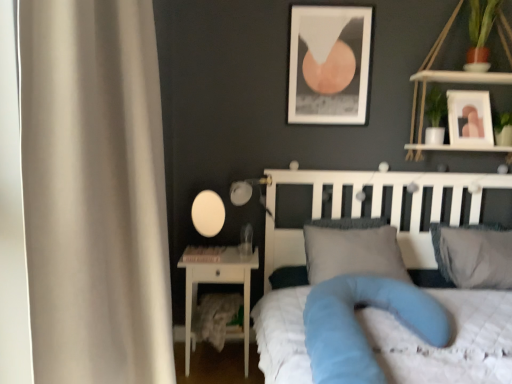
Locate an element on the screen. gray fabric pillow at center, placed as the 1th pillow when sorted from left to right is located at coordinates (353, 253).

Measure the distance between point [310,271] and camera.

The distance of point [310,271] from camera is 7.57 feet.

Describe the element at coordinates (94, 192) in the screenshot. The image size is (512, 384). I see `white fabric curtain at left` at that location.

In the scene shown: How much space does matte white picture frame at upper center, which is counted as the 2th picture frame, starting from the right, occupy horizontally?

The width of matte white picture frame at upper center, which is counted as the 2th picture frame, starting from the right, is 1.25 inches.

I want to click on gray fabric pillow at right, the 1th pillow from the right, so click(x=474, y=255).

Find the location of a particular element. white matte lampshade at center is located at coordinates (208, 213).

Considering the sizes of objects white wood shelf at upper right and gray fabric pillow at center, placed as the 1th pillow when sorted from left to right, in the image provided, who is wider, white wood shelf at upper right or gray fabric pillow at center, placed as the 1th pillow when sorted from left to right,?

Wider between the two is gray fabric pillow at center, placed as the 1th pillow when sorted from left to right.

Is white wood shelf at upper right facing towards gray fabric pillow at center, placed as the 1th pillow when sorted from left to right?

No, white wood shelf at upper right is not turned towards gray fabric pillow at center, placed as the 1th pillow when sorted from left to right.

Considering the positions of point (506, 82) and point (349, 263), is point (506, 82) closer or farther from the camera than point (349, 263)?

Point (506, 82) appears to be farther away from the viewer than point (349, 263).

Is white wood shelf at upper right not inside gray fabric pillow at center, the second pillow viewed from the right?

That's correct, white wood shelf at upper right is outside of gray fabric pillow at center, the second pillow viewed from the right.

Is white fabric curtain at left further to the viewer compared to gray fabric pillow at center, placed as the 1th pillow when sorted from left to right?

No, white fabric curtain at left is closer to the viewer.

Which of these two, white fabric curtain at left or gray fabric pillow at center, the second pillow viewed from the right, stands shorter?

With less height is gray fabric pillow at center, the second pillow viewed from the right.

Is white fabric curtain at left in contact with gray fabric pillow at center, the second pillow viewed from the right?

There is a gap between white fabric curtain at left and gray fabric pillow at center, the second pillow viewed from the right.

Does white quilted bed at center turn towards white matte lampshade at center?

No, white quilted bed at center is not turned towards white matte lampshade at center.

Based on the photo, from a real-world perspective, does white quilted bed at center stand above white matte lampshade at center?

→ No, from a real-world perspective, white quilted bed at center is not above white matte lampshade at center.

Is white quilted bed at center positioned behind white matte lampshade at center?

No.

Does point (498, 241) come closer to viewer compared to point (321, 245)?

That is False.

From the image's perspective, which object appears higher, gray fabric pillow at right, which is counted as the 2th pillow, starting from the left, or gray fabric pillow at center, placed as the 1th pillow when sorted from left to right?

gray fabric pillow at center, placed as the 1th pillow when sorted from left to right.

Is gray fabric pillow at center, the second pillow viewed from the right, completely or partially inside gray fabric pillow at right, the 1th pillow from the right?

No, gray fabric pillow at center, the second pillow viewed from the right, is located outside of gray fabric pillow at right, the 1th pillow from the right.

Consider the image. Is gray fabric pillow at right, the 1th pillow from the right, turned away from gray fabric pillow at center, placed as the 1th pillow when sorted from left to right?

gray fabric pillow at right, the 1th pillow from the right, is not turned away from gray fabric pillow at center, placed as the 1th pillow when sorted from left to right.

Considering the relative positions of white matte lampshade at center and white matte picture frame at upper right, the 2th picture frame from the left, in the image provided, is white matte lampshade at center behind white matte picture frame at upper right, the 2th picture frame from the left,?

Yes.

How different are the orientations of white matte lampshade at center and white matte picture frame at upper right, the first picture frame from the right, in degrees?

The angle between the facing direction of white matte lampshade at center and the facing direction of white matte picture frame at upper right, the first picture frame from the right, is 0.845 degrees.

Considering the positions of point (192, 205) and point (451, 118), is point (192, 205) closer or farther from the camera than point (451, 118)?

Point (192, 205) appears to be farther away from the viewer than point (451, 118).

Consider the image. Does white glossy nightstand at lower left appear on the left side of white quilted bed at center?

Correct, you'll find white glossy nightstand at lower left to the left of white quilted bed at center.

Could you tell me if white glossy nightstand at lower left is facing white quilted bed at center?

No, white glossy nightstand at lower left is not oriented towards white quilted bed at center.

Is white glossy nightstand at lower left in front of white quilted bed at center?

No, white glossy nightstand at lower left is further to the viewer.

In the scene shown: From the image's perspective, who appears lower, white wood shelf at upper right or blue fabric mattress at center?

→ blue fabric mattress at center appears lower in the image.

Considering the relative sizes of white wood shelf at upper right and blue fabric mattress at center in the image provided, is white wood shelf at upper right shorter than blue fabric mattress at center?

No.

Does point (462, 75) appear closer or farther from the camera than point (492, 328)?

Point (462, 75) is positioned farther from the camera compared to point (492, 328).

Is white wood shelf at upper right oriented away from blue fabric mattress at center?

white wood shelf at upper right is not turned away from blue fabric mattress at center.

Find the location of `shelf above the gray fabric pillow at center, placed as the 1th pillow when sorted from left to right (from a real-world perspective)`. shelf above the gray fabric pillow at center, placed as the 1th pillow when sorted from left to right (from a real-world perspective) is located at coordinates (455, 82).

At what (x,y) coordinates should I click in order to perform the action: click on curtain lying above the gray fabric pillow at center, placed as the 1th pillow when sorted from left to right (from the image's perspective). Please return your answer as a coordinate pair (x, y). This screenshot has width=512, height=384. Looking at the image, I should click on pos(94,192).

When comparing their distances from white wood shelf at upper right, does white matte lampshade at center or white glossy nightstand at lower left seem further?

The object further to white wood shelf at upper right is white glossy nightstand at lower left.

From the image, which object appears to be farther from gray fabric pillow at right, the 1th pillow from the right, white fabric curtain at left or white glossy nightstand at lower left?

white fabric curtain at left is positioned further to the anchor gray fabric pillow at right, the 1th pillow from the right.

From the image, which object appears to be farther from white fabric curtain at left, white matte picture frame at upper right, the 2th picture frame from the left, or white wood shelf at upper right?

white matte picture frame at upper right, the 2th picture frame from the left, lies further to white fabric curtain at left than the other object.

Which object lies nearer to the anchor point blue fabric mattress at center, gray fabric pillow at right, which is counted as the 2th pillow, starting from the left, or white matte picture frame at upper right, the 2th picture frame from the left?

Among the two, gray fabric pillow at right, which is counted as the 2th pillow, starting from the left, is located nearer to blue fabric mattress at center.

Considering their positions, is gray fabric pillow at center, the second pillow viewed from the right, positioned closer to white quilted bed at center than white glossy nightstand at lower left?

Based on the image, gray fabric pillow at center, the second pillow viewed from the right, appears to be nearer to white quilted bed at center.

From the image, which object appears to be nearer to matte white picture frame at upper center, which is counted as the 2th picture frame, starting from the right, blue fabric mattress at center or white quilted bed at center?

white quilted bed at center is closer to matte white picture frame at upper center, which is counted as the 2th picture frame, starting from the right.

Estimate the real-world distances between objects in this image. Which object is further from blue fabric mattress at center, matte white picture frame at upper center, which is counted as the 2th picture frame, starting from the right, or white quilted bed at center?

Among the two, matte white picture frame at upper center, which is counted as the 2th picture frame, starting from the right, is located further to blue fabric mattress at center.

Estimate the real-world distances between objects in this image. Which object is closer to gray fabric pillow at right, which is counted as the 2th pillow, starting from the left, white matte lampshade at center or white wood shelf at upper right?

white wood shelf at upper right is positioned closer to the anchor gray fabric pillow at right, which is counted as the 2th pillow, starting from the left.

You are a GUI agent. You are given a task and a screenshot of the screen. Output one action in this format:
    pyautogui.click(x=<x>, y=<y>)
    Task: Click on the shelf between white fabric curtain at left and matte white picture frame at upper center, the 1th picture frame from the left, from front to back
    The height and width of the screenshot is (384, 512).
    Given the screenshot: What is the action you would take?
    pyautogui.click(x=455, y=82)

Locate an element on the screen. This screenshot has height=384, width=512. nightstand situated between white matte lampshade at center and white matte picture frame at upper right, the 2th picture frame from the left, from left to right is located at coordinates (219, 283).

Find the location of a particular element. This screenshot has height=384, width=512. nightstand positioned between white fabric curtain at left and white matte picture frame at upper right, the first picture frame from the right, from near to far is located at coordinates (219, 283).

This screenshot has height=384, width=512. I want to click on pillow between white matte lampshade at center and white matte picture frame at upper right, the 2th picture frame from the left, from left to right, so click(x=353, y=253).